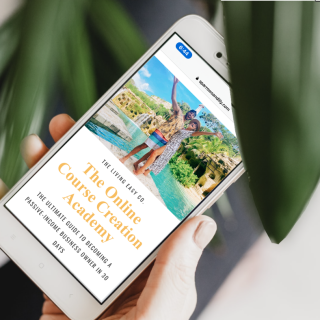
Where is `green leafy plant`? This screenshot has width=320, height=320. green leafy plant is located at coordinates (66, 31), (280, 74).